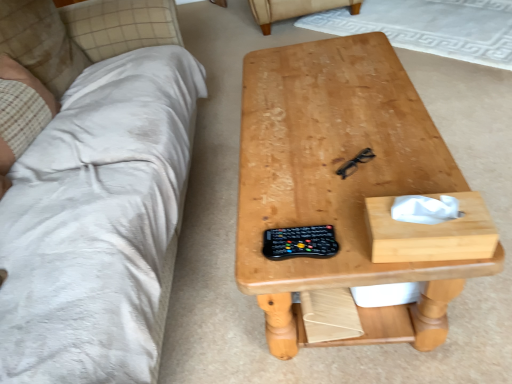
Where is `empty space that is ontop of natural wood table at center (from a real-world perspective)`? This screenshot has height=384, width=512. empty space that is ontop of natural wood table at center (from a real-world perspective) is located at coordinates (326, 122).